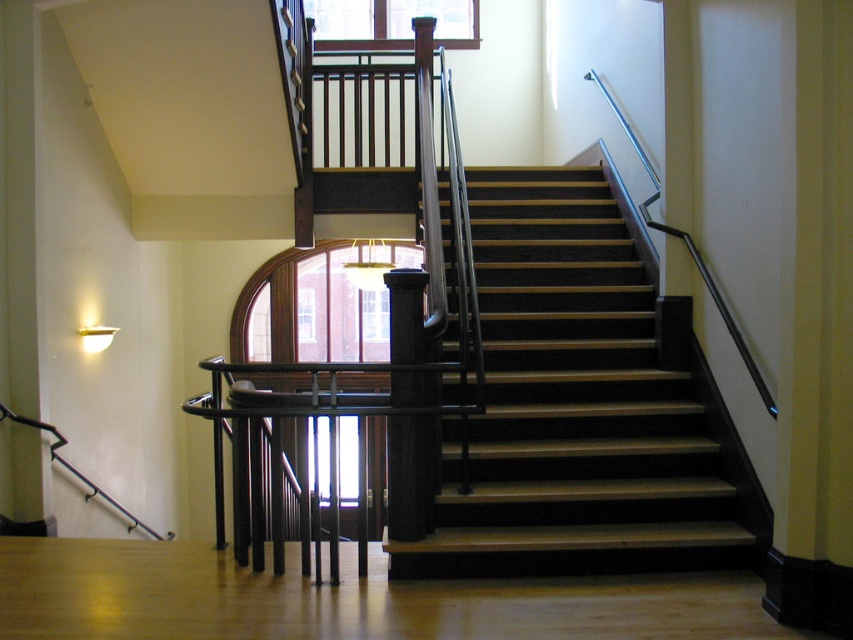
Is wooden stairs at center thinner than black polished wood pillar at center?

No.

Where is `wooden stairs at center`? The width and height of the screenshot is (853, 640). wooden stairs at center is located at coordinates (579, 408).

Between point (608, 438) and point (389, 436), which one is positioned behind?

Positioned behind is point (608, 438).

At what (x,y) coordinates should I click in order to perform the action: click on wooden stairs at center. Please return your answer as a coordinate pair (x, y). Looking at the image, I should click on (579, 408).